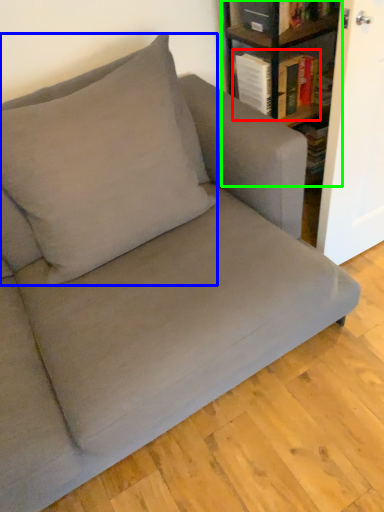
Question: Which is nearer to the book (highlighted by a red box)? throw pillow (highlighted by a blue box) or shelf (highlighted by a green box).

Choices:
 (A) throw pillow
 (B) shelf

Answer: (B)